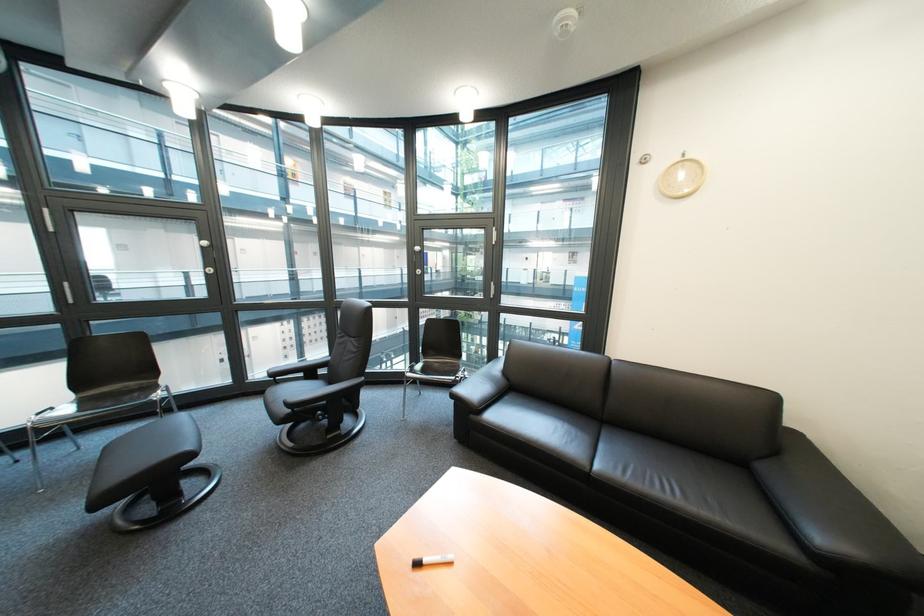
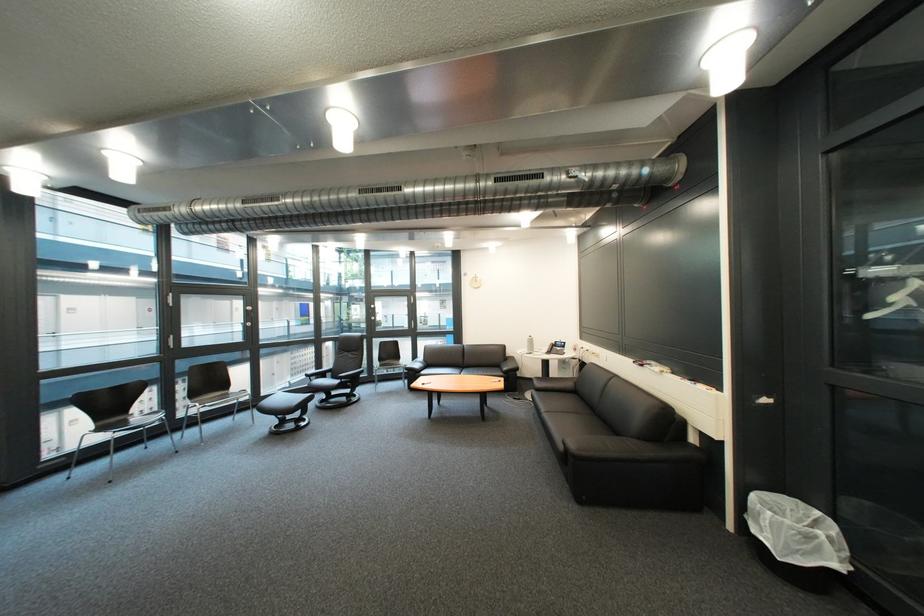
The point at (287,381) is marked in the first image. Where is the corresponding point in the second image?

(322, 379)